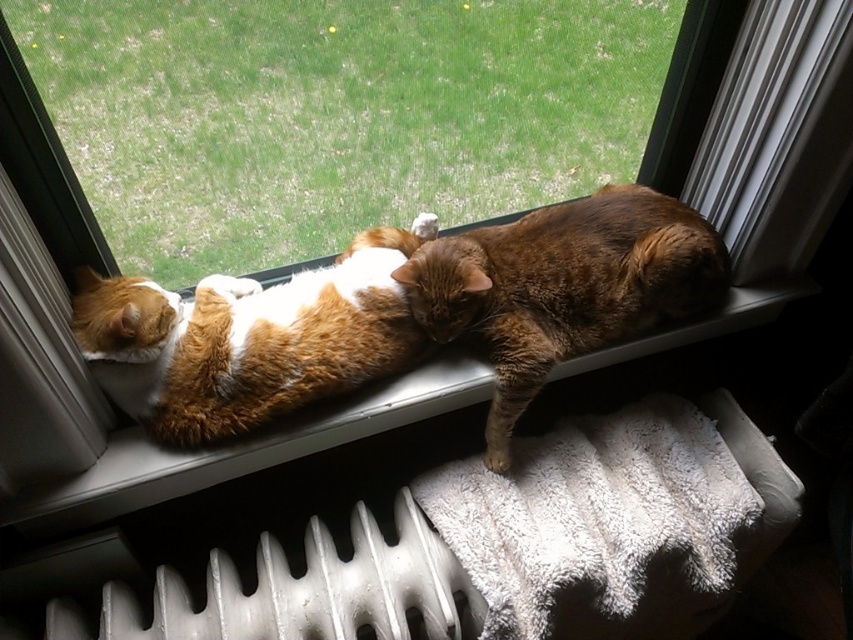
Between orange fur cat at center and metallic silver radiator at lower left, which one appears on the right side from the viewer's perspective?

Positioned to the right is orange fur cat at center.

Does point (238, 426) come closer to viewer compared to point (454, 604)?

That is True.

Identify the location of orange fur cat at center. (248, 339).

Is metallic silver radiator at lower left thinner than white textured window sill at center?

Yes, metallic silver radiator at lower left is thinner than white textured window sill at center.

Does metallic silver radiator at lower left have a lesser height compared to white textured window sill at center?

Correct, metallic silver radiator at lower left is not as tall as white textured window sill at center.

Does point (317, 589) come closer to viewer compared to point (300, 454)?

Yes.

At what (x,y) coordinates should I click in order to perform the action: click on metallic silver radiator at lower left. Please return your answer as a coordinate pair (x, y). Looking at the image, I should click on (314, 589).

Does orange fur cat at center appear over tabby fur cat at center?

Incorrect, orange fur cat at center is not positioned above tabby fur cat at center.

The width and height of the screenshot is (853, 640). I want to click on orange fur cat at center, so click(248, 339).